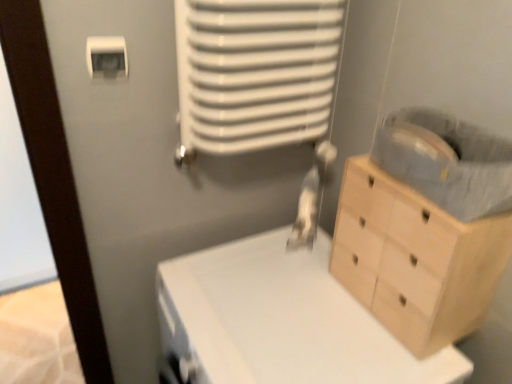
Image resolution: width=512 pixels, height=384 pixels. I want to click on blank space situated above white matte changing table at center (from a real-world perspective), so click(x=289, y=309).